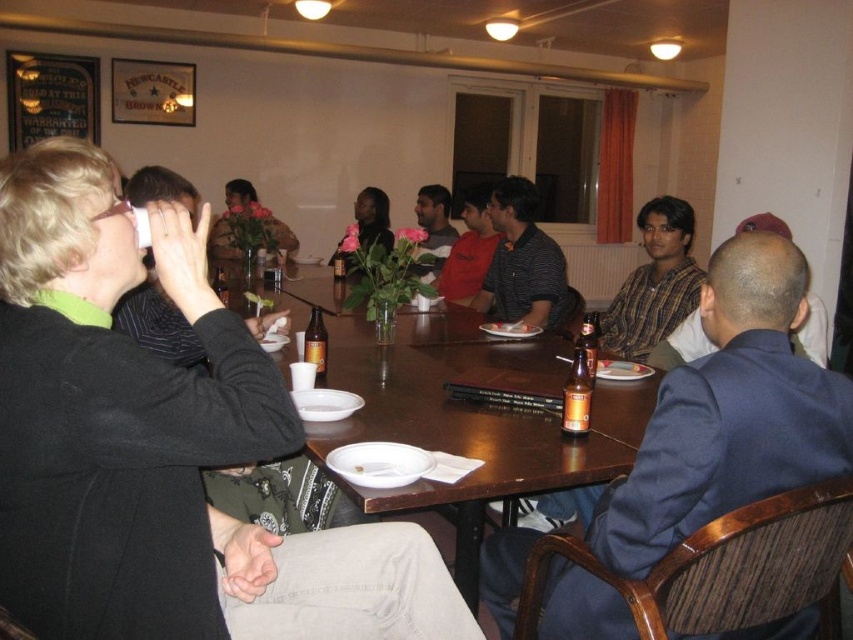
You are planning to place a new decorative item on the brown wooden table at center. Considering the size of the dark blue suit at center, will there be enough space on the table?

The brown wooden table at center is larger in size than the dark blue suit at center, so there should be sufficient space on the table to place the new decorative item.

You are sitting at the table and want to hand a document to the person wearing the checkered shirt at center. The brown glass bottle at table center is blocking your path. Which direction should you move the bottle to reach the person?

You should move the brown glass bottle at table center to the left, as the checkered shirt at center is to the right of it.